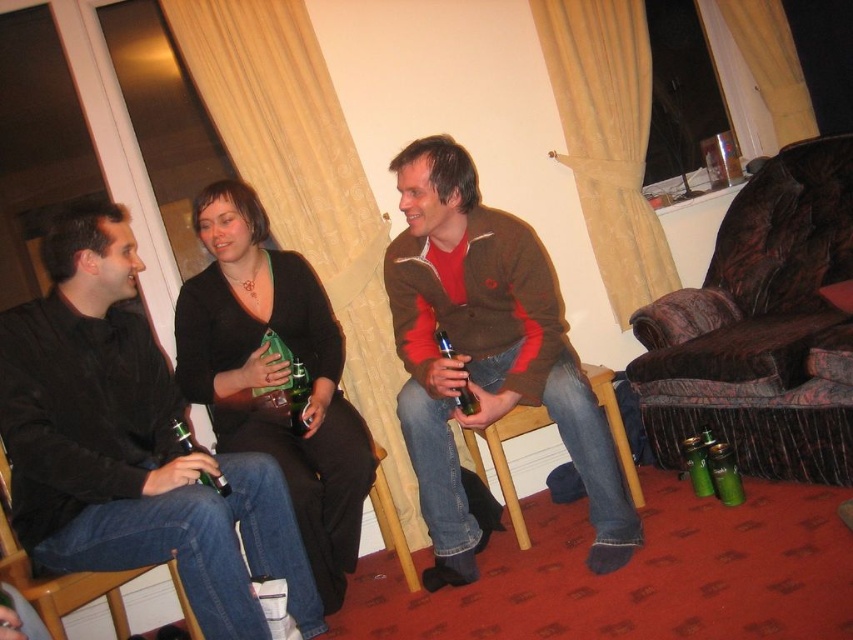
You are a photographer setting up for a group photo in this living room. You need to ensure that the matte black sweater at center and the green glass bottle at lower left are both visible in the shot. Based on their positions, which object is closer to the camera?

The matte black sweater at center is located above the green glass bottle at lower left, so it is closer to the camera.

You are a delivery person who needs to place a package between the matte black shirt at left and the matte glass bottle at center. The package is 30 inches long. Will it fit in the space between them?

The distance between the matte black shirt at left and the matte glass bottle at center is 32.95 inches. Since the package is 30 inches long, it will fit in the space between them.